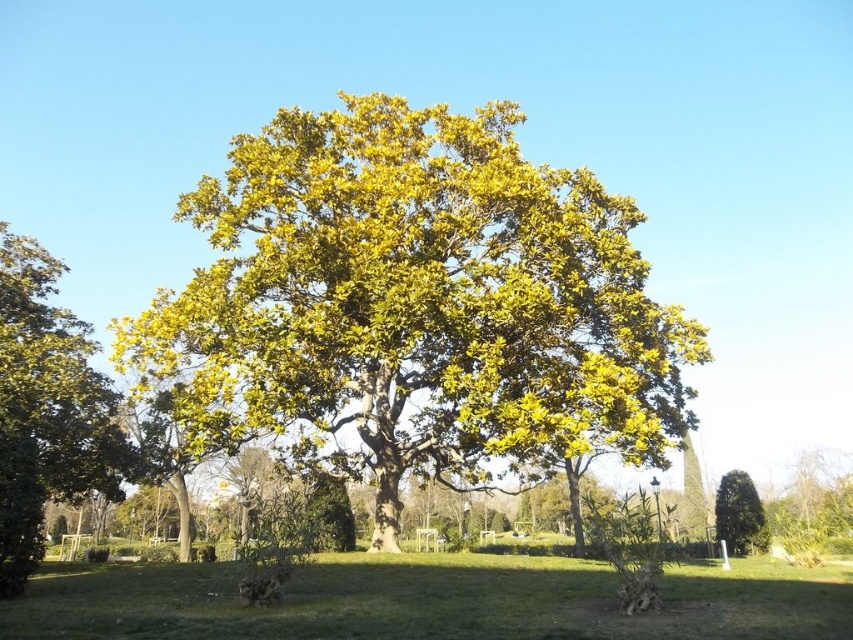
You are planning to place a picnic blanket under both the green leafy oak tree at center and the green leafy tree at left. Which tree provides more shade coverage for the blanket?

The green leafy oak tree at center might provide more shade coverage since it is wider than the green leafy tree at left.

You are standing in the park looking at the large tree. There are two points marked on the tree. One is at coordinate point (386, 349) and the other is at point (115, 452). Which point is closer to you?

Point (386, 349) is closer to the viewer than point (115, 452).

From the picture: You are standing in a park and see the large tree with yellow green leaves. There is a point marked at coordinates (x=431, y=602). What is located at that point?

The point at coordinates (x=431, y=602) indicates green grass at center.